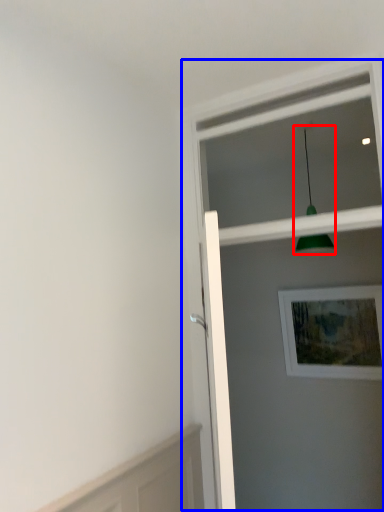
Question: Which point is further to the camera, light fixture (highlighted by a red box) or screen door (highlighted by a blue box)?

Choices:
 (A) light fixture
 (B) screen door

Answer: (A)